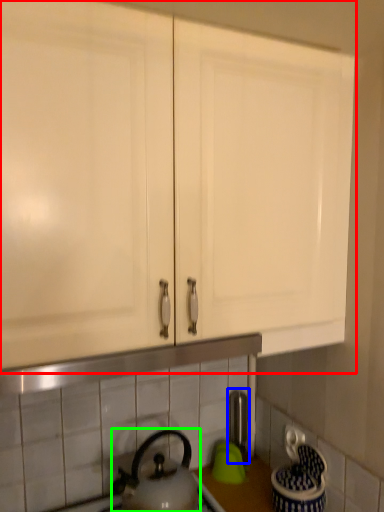
Question: Based on their relative distances, which object is nearer to cabinetry (highlighted by a red box)? Choose from faucet (highlighted by a blue box) and kettle (highlighted by a green box).

Choices:
 (A) faucet
 (B) kettle

Answer: (B)